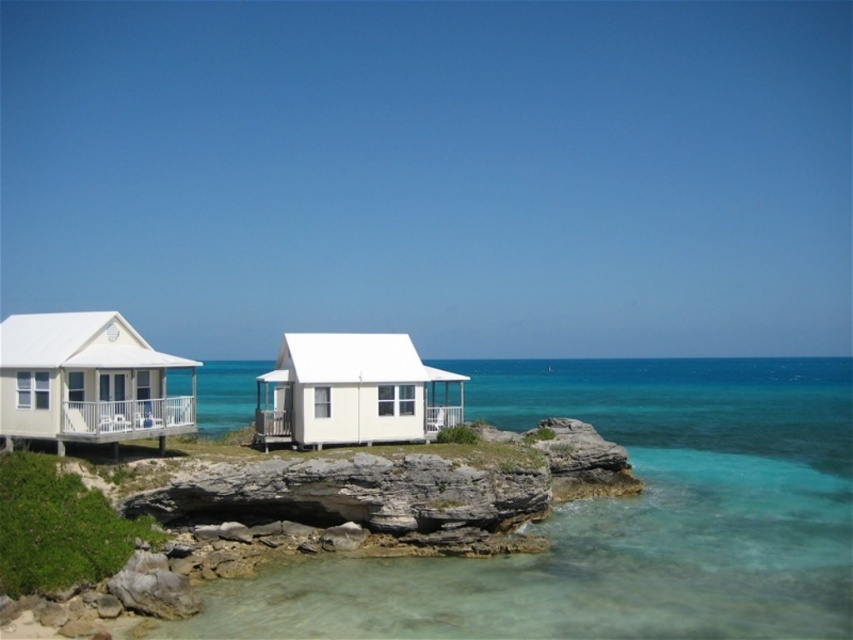
Question: Which object appears closest to the camera in this image?

Choices:
 (A) white matte cabin at center
 (B) white matte cabin at left
 (C) clear glass water at center

Answer: (C)

Question: Can you confirm if white matte cabin at left is positioned above white matte cabin at center?

Choices:
 (A) yes
 (B) no

Answer: (A)

Question: Is white matte cabin at left above white matte cabin at center?

Choices:
 (A) no
 (B) yes

Answer: (B)

Question: Which point appears farthest from the camera in this image?

Choices:
 (A) (277, 433)
 (B) (96, 442)
 (C) (614, 536)

Answer: (A)

Question: Which object is farther from the camera taking this photo?

Choices:
 (A) clear glass water at center
 (B) white matte cabin at center
 (C) white matte cabin at left

Answer: (B)

Question: Does clear glass water at center appear under white matte cabin at left?

Choices:
 (A) yes
 (B) no

Answer: (A)